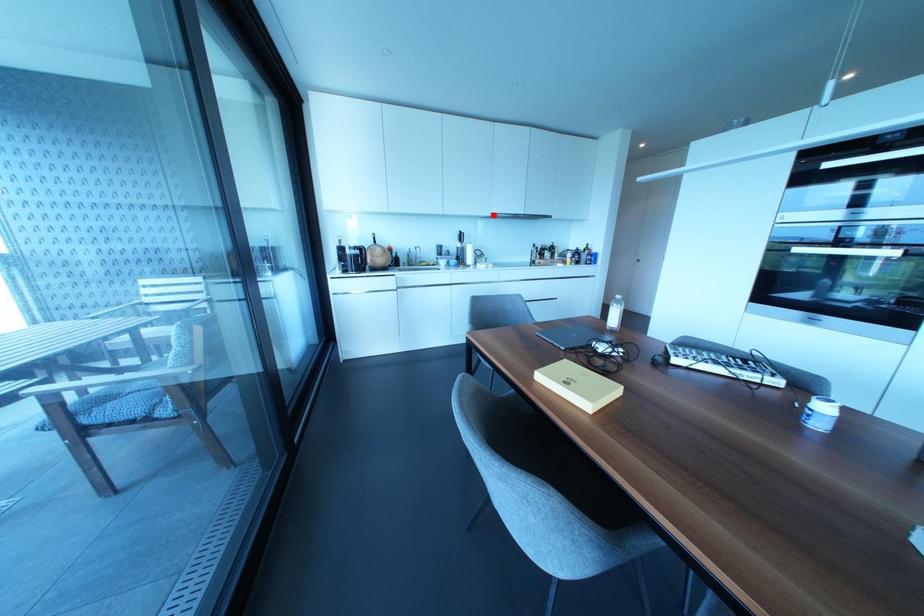
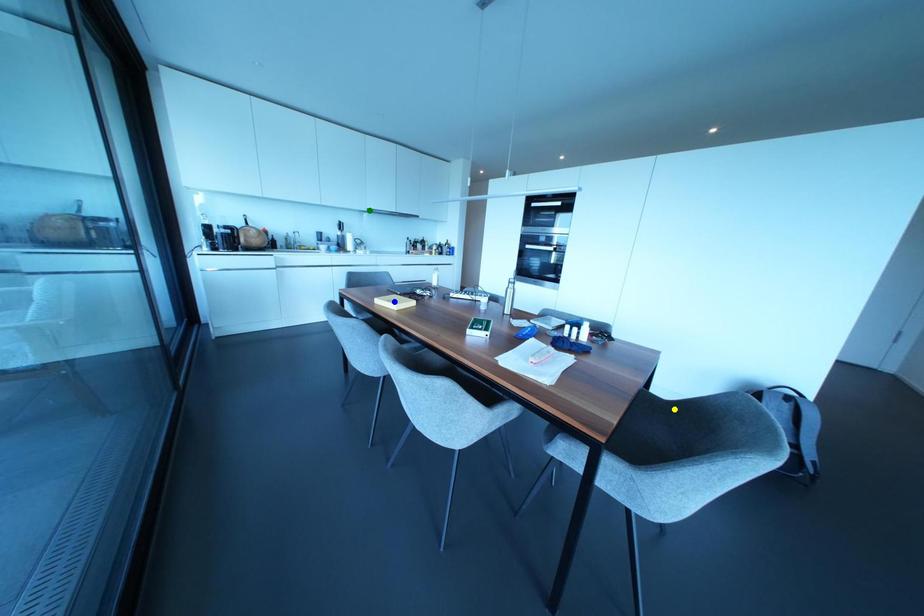
Question: I am providing you with two images of the same scene from different viewpoints. A red point is marked on the first image. You are given multiple points on the second image. Which mark in image 2 goes with the point in image 1?

Choices:
 (A) green point
 (B) blue point
 (C) yellow point

Answer: (A)